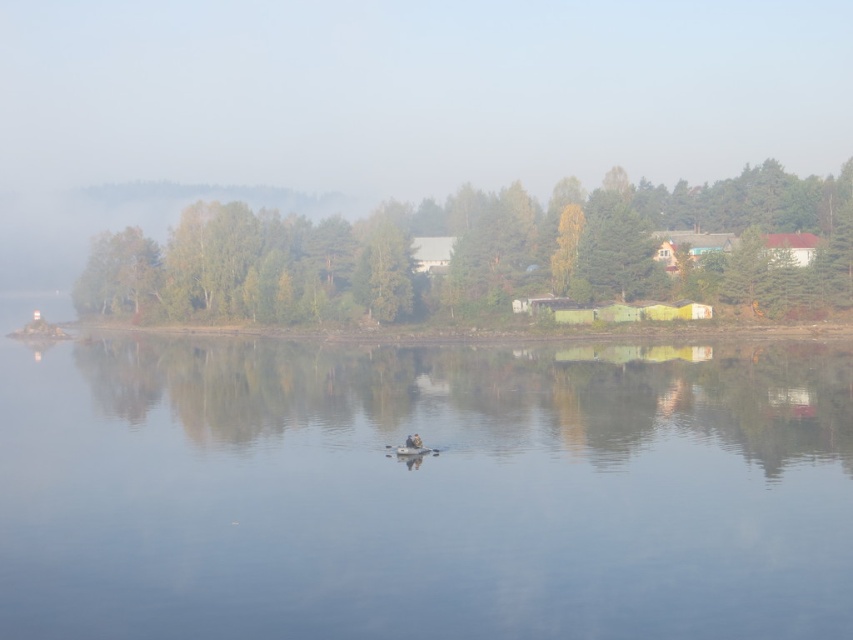
Is point (711, 488) positioned behind point (483, 228)?

No, (711, 488) is closer to viewer.

Is transparent water at center behind green matte tree at center?

No.

Is point (672, 461) closer to viewer compared to point (808, 294)?

Yes, point (672, 461) is in front of point (808, 294).

Where is `transparent water at center`? transparent water at center is located at coordinates (422, 490).

Between transparent water at center and white plastic boat at center, which one has less height?

With less height is white plastic boat at center.

Is transparent water at center shorter than white plastic boat at center?

Incorrect, transparent water at center's height does not fall short of white plastic boat at center's.

I want to click on transparent water at center, so click(422, 490).

Is green matte tree at center positioned at the back of white plastic boat at center?

Yes, it is behind white plastic boat at center.

Image resolution: width=853 pixels, height=640 pixels. What do you see at coordinates (486, 253) in the screenshot?
I see `green matte tree at center` at bounding box center [486, 253].

Is point (434, 246) closer to camera compared to point (405, 449)?

No, (434, 246) is further to viewer.

Where is `green matte tree at center`? green matte tree at center is located at coordinates (486, 253).